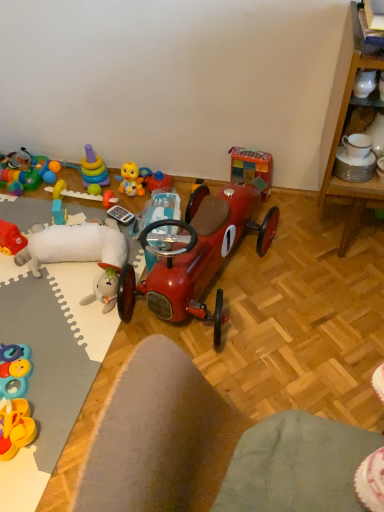
Image resolution: width=384 pixels, height=512 pixels. In order to click on vacant space situated above rubberized multicolored ball at left, acting as the 1th toy starting from the left (from a real-world perspective) in this screenshot , I will do `click(23, 162)`.